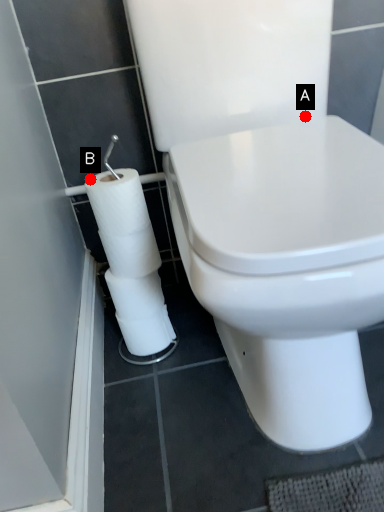
Question: Two points are circled on the image, labeled by A and B beside each circle. Which of the following is the farthest from the observer?

Choices:
 (A) A is further
 (B) B is further

Answer: (A)